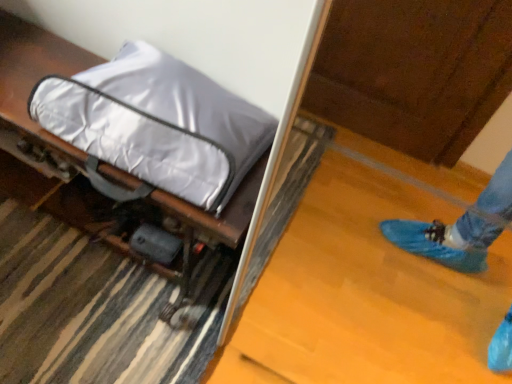
This screenshot has height=384, width=512. In order to click on silver reflective bag at upper left in this screenshot , I will do (x=139, y=148).

The height and width of the screenshot is (384, 512). What do you see at coordinates (139, 148) in the screenshot?
I see `silver reflective bag at upper left` at bounding box center [139, 148].

At what (x,y) coordinates should I click in order to perform the action: click on silver reflective bag at upper left. Please return your answer as a coordinate pair (x, y). The image size is (512, 384). Looking at the image, I should click on (139, 148).